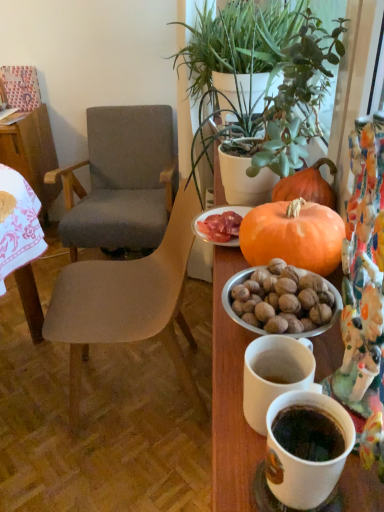
Question: Considering their positions, is green leafy plant at upper right, marked as the first houseplant in a front-to-back arrangement, located in front of or behind gray fabric chair at center, which is the second chair from front to back?

Choices:
 (A) behind
 (B) front

Answer: (B)

Question: Visually, is green leafy plant at upper right, marked as the 2th houseplant in a back-to-front arrangement, positioned to the left or to the right of gray fabric chair at center, the first chair viewed from the back?

Choices:
 (A) left
 (B) right

Answer: (B)

Question: Based on their relative distances, which object is farther from the orange matte pumpkin at center?

Choices:
 (A) textured gray fabric chair at left, which is counted as the 2th chair, starting from the back
 (B) matte orange plate at center
 (C) gray fabric chair at center, the first chair viewed from the back
 (D) green leafy plant at upper center, which ranks as the 2th houseplant in front-to-back order
 (E) white ceramic mug at lower right

Answer: (C)

Question: Which is farther from the textured gray fabric chair at left, the 1th chair in the front-to-back sequence?

Choices:
 (A) gray fabric chair at center, the first chair viewed from the back
 (B) white ceramic mug at lower right
 (C) green leafy plant at upper right, marked as the 2th houseplant in a back-to-front arrangement
 (D) green leafy plant at upper center, which ranks as the 2th houseplant in front-to-back order
 (E) wooden table at left

Answer: (E)